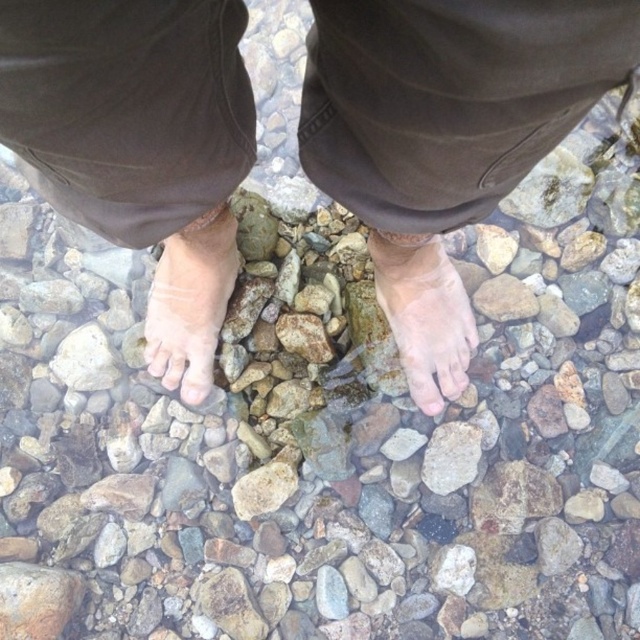
Question: Among these points, which one is farthest from the camera?

Choices:
 (A) (460, 394)
 (B) (186, 304)
 (C) (138, 109)

Answer: (A)

Question: Can you confirm if skinny bare feet at center is positioned to the left of pale skin at center?

Choices:
 (A) no
 (B) yes

Answer: (A)

Question: Observing the image, what is the correct spatial positioning of pale skin foot at center in reference to pale skin at center?

Choices:
 (A) right
 (B) left

Answer: (A)

Question: Which is nearer to the skinny bare feet at center?

Choices:
 (A) pale skin foot at center
 (B) pale skin at center

Answer: (B)

Question: From the image, what is the correct spatial relationship of skinny bare feet at center in relation to pale skin foot at center?

Choices:
 (A) left
 (B) right

Answer: (A)

Question: Which of the following is the closest to the observer?

Choices:
 (A) skinny bare feet at center
 (B) pale skin foot at center
 (C) pale skin at center

Answer: (A)